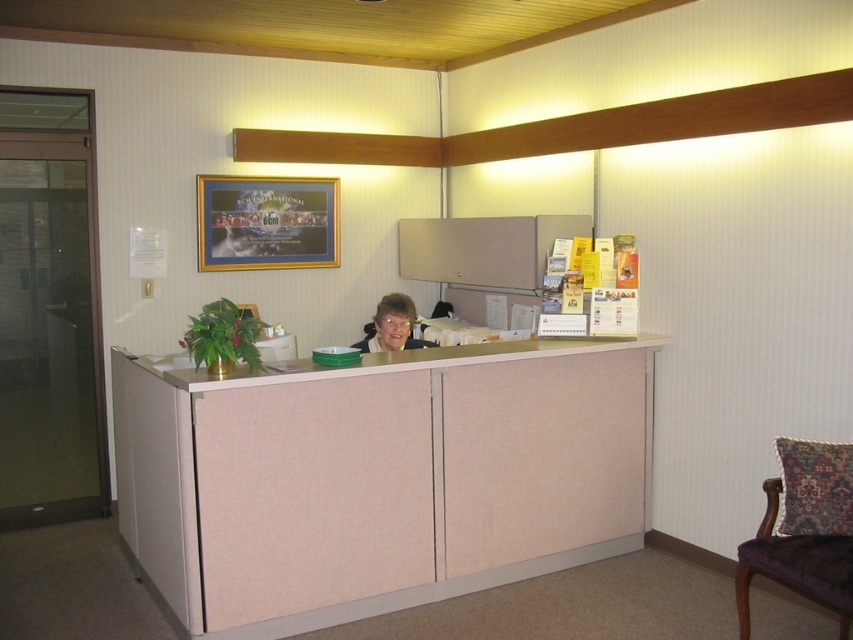
You are a visitor entering the reception area and need to place a large folder on the desk. Given that the folder is 30 cm wide, will it fit on the beige fabric desk at center without overlapping the matte black hair at center?

The beige fabric desk at center has a width larger than the matte black hair at center. Since the desk is wider, the 30 cm folder should fit without overlapping the matte black hair at center, provided there is enough space on the desk.

You are a visitor in this reception area and want to sit down. There is a velvet purple chair at lower right. Is the point at position (804,529) on the velvet purple chair at lower right?

Yes, the point at position (804,529) is on the velvet purple chair at lower right according to the description.

You are a visitor at the reception area and need to sit down. There is a velvet purple chair at lower right and a person with matte black hair at center. Which object is taller so you can choose the appropriate seating?

The velvet purple chair at lower right is much taller than the matte black hair at center, so the velvet purple chair at lower right is the taller object and suitable for seating.